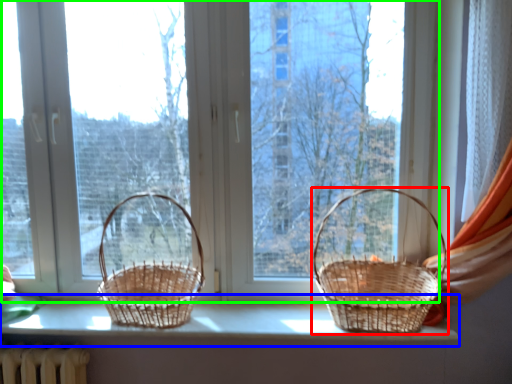
Question: Which object is positioned farthest from picnic basket (highlighted by a red box)? Select from window sill (highlighted by a blue box) and window (highlighted by a green box).

Choices:
 (A) window sill
 (B) window

Answer: (B)